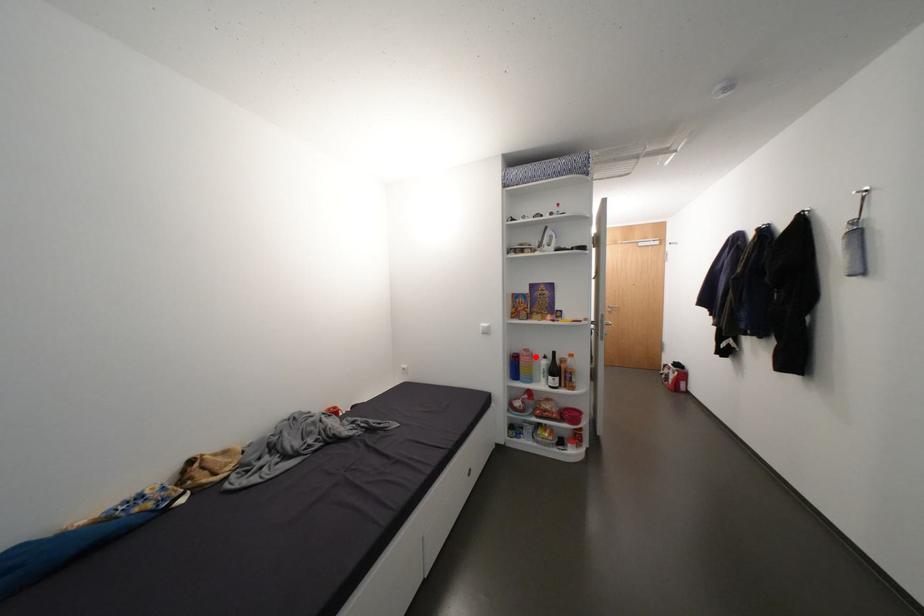
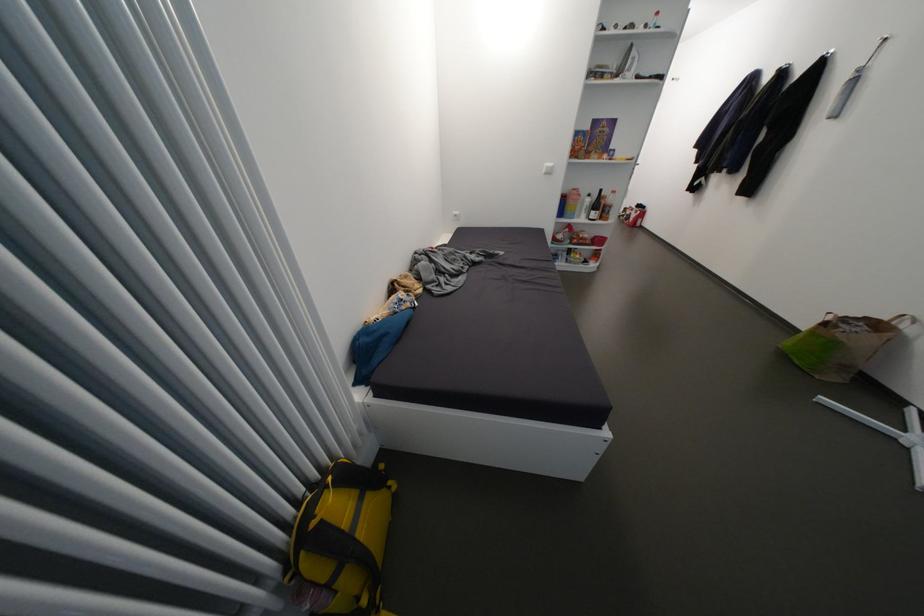
In the second image, find the point that corresponds to the highlighted location in the first image.

(585, 196)